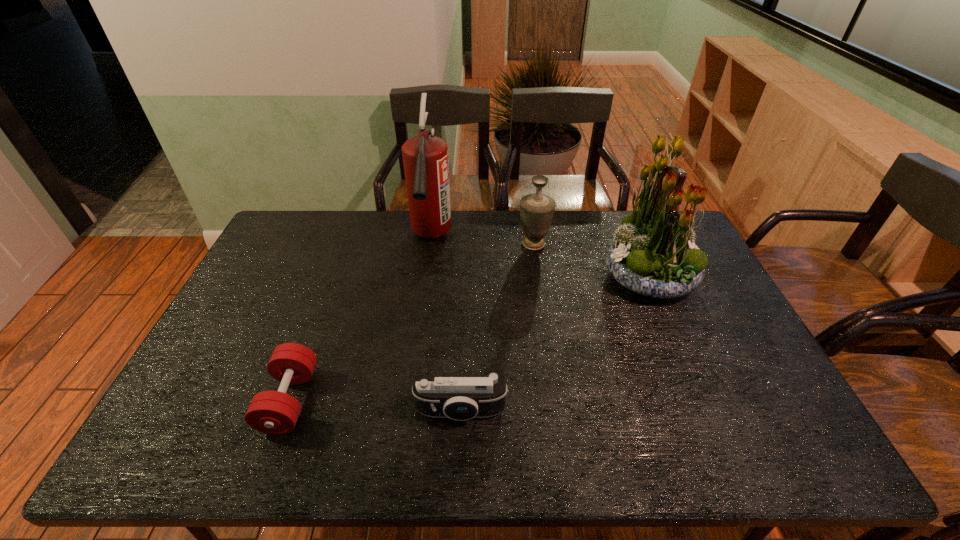
The image size is (960, 540). I want to click on vacant area that satisfies the following two spatial constraints: 1. at the nozzle of the fire extinguisher; 2. on the right side of the urn, so click(430, 244).

Image resolution: width=960 pixels, height=540 pixels. I want to click on vacant space that satisfies the following two spatial constraints: 1. at the nozzle of the urn; 2. on the right side of the fire extinguisher, so click(x=430, y=244).

This screenshot has width=960, height=540. I want to click on vacant space that satisfies the following two spatial constraints: 1. at the nozzle of the urn; 2. on the left side of the fire extinguisher, so click(x=430, y=244).